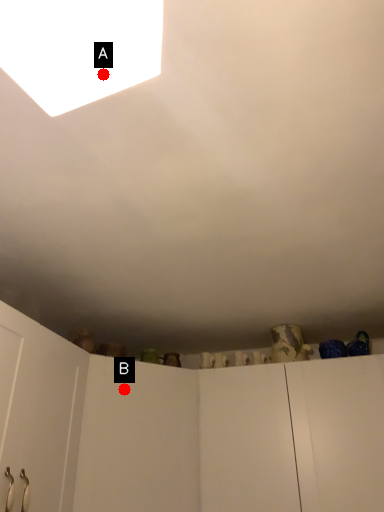
Question: Two points are circled on the image, labeled by A and B beside each circle. Which point is further to the camera?

Choices:
 (A) A is further
 (B) B is further

Answer: (B)